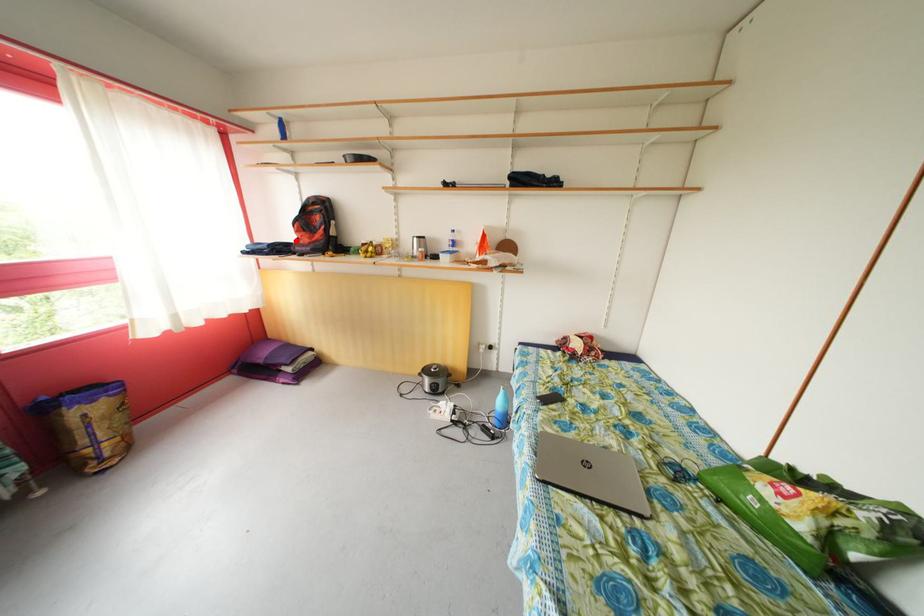
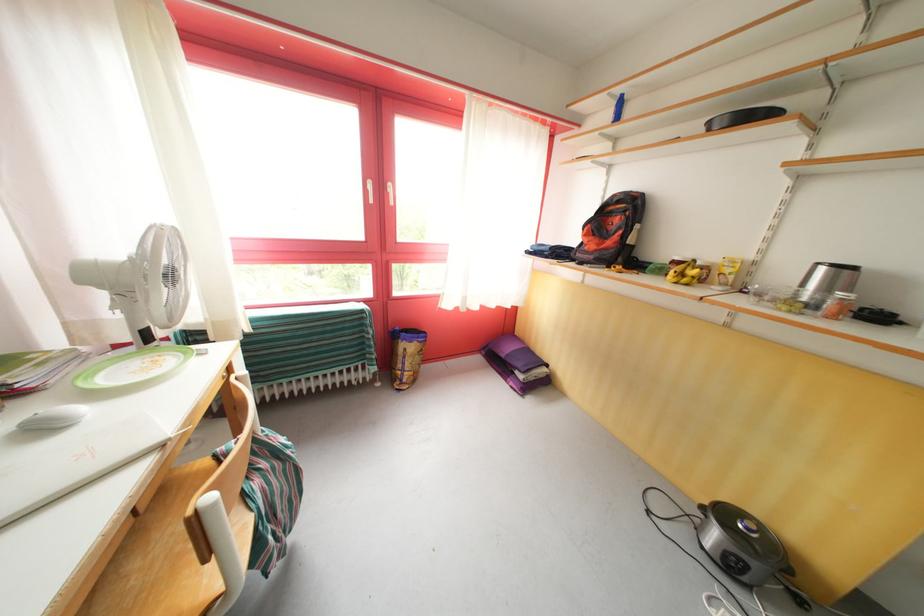
In the second image, find the point that corresponds to the highlighted location in the first image.

(580, 245)